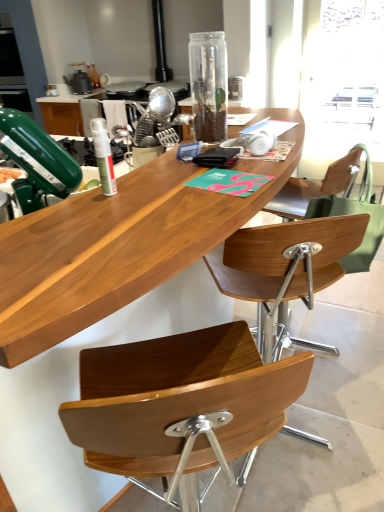
Where is `vacant space behind white matte spray can at center, which appears as the 1th bottle when viewed from the front`? vacant space behind white matte spray can at center, which appears as the 1th bottle when viewed from the front is located at coordinates (132, 177).